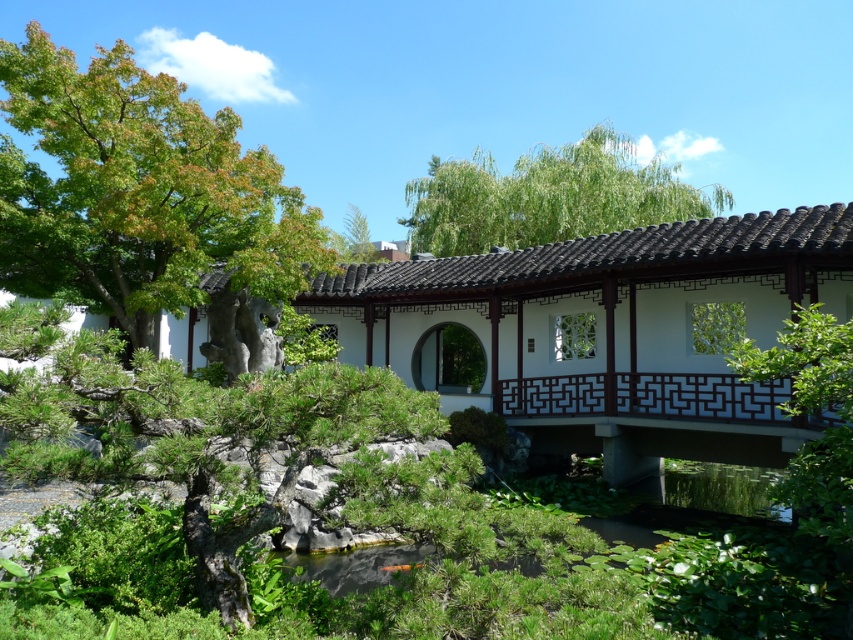
You are standing in the garden and want to take a photo of both the green leafy tree at left and the green leafy tree at upper center. Which tree should you position yourself closer to in order to capture both in the same frame?

To capture both the green leafy tree at left and the green leafy tree at upper center in the same frame, you should position yourself closer to the green leafy tree at left since it is positioned below the green leafy tree at upper center, allowing for a wider angle to include both.

You are a visitor standing at the entrance of the garden. You see the white wood bridge at center and the green leafy tree at left. Which object appears taller from your viewpoint?

The green leafy tree at left appears taller than the white wood bridge at center since the bridge has a lesser height compared to the tree.